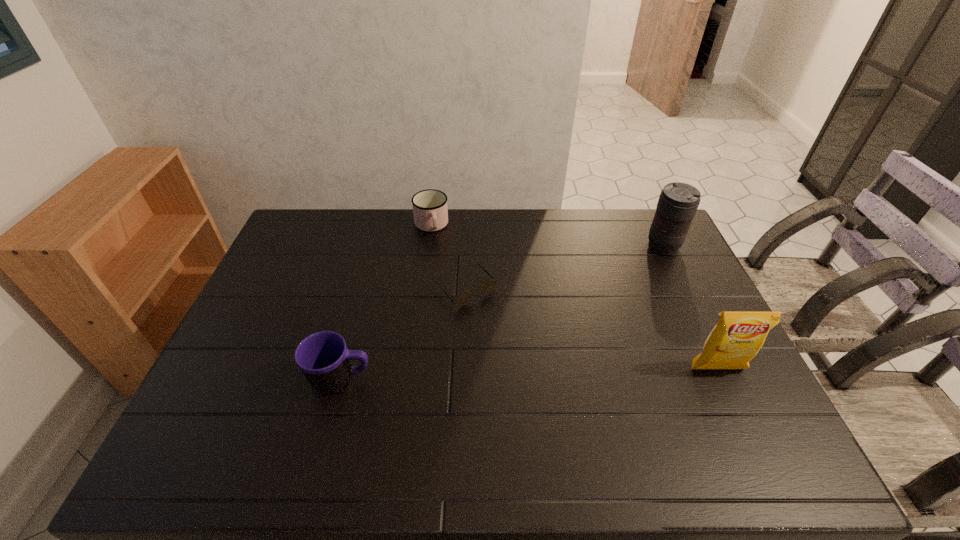
Where is `free space on the desktop that is between the nearer mug and the crisp (potato chip) and is positioned on the front-facing side of the sunglasses`? free space on the desktop that is between the nearer mug and the crisp (potato chip) and is positioned on the front-facing side of the sunglasses is located at coordinates (542, 374).

Image resolution: width=960 pixels, height=540 pixels. Identify the location of vacant space on the desktop that is between the taller mug and the crisp (potato chip) and is positioned on the side of the telephoto lens where the control switches are located. (523, 375).

The height and width of the screenshot is (540, 960). I want to click on vacant space on the desktop that is between the third shortest object and the crisp (potato chip) and is positioned on the side of the right mug with the handle, so 476,376.